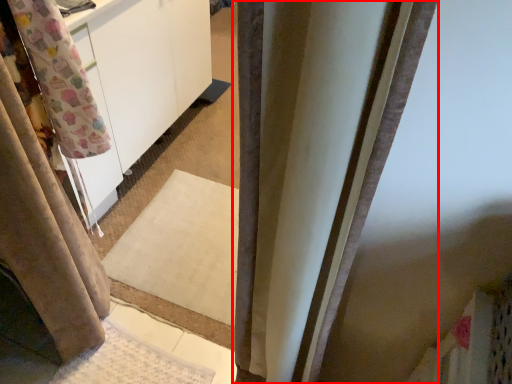
Question: From the image's perspective, considering the relative positions of curtain (annotated by the red box) and curtain in the image provided, where is curtain (annotated by the red box) located with respect to the staircase?

Choices:
 (A) above
 (B) below

Answer: (A)